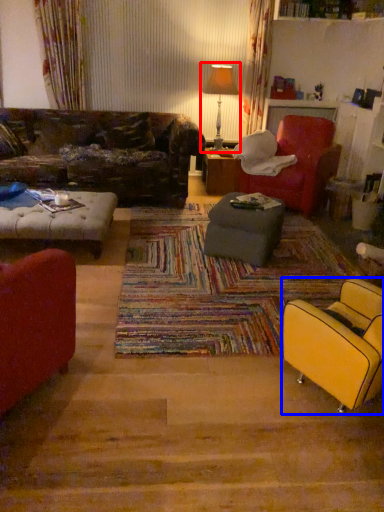
Question: Which object is closer to the camera taking this photo, lamp (highlighted by a red box) or chair (highlighted by a blue box)?

Choices:
 (A) lamp
 (B) chair

Answer: (B)